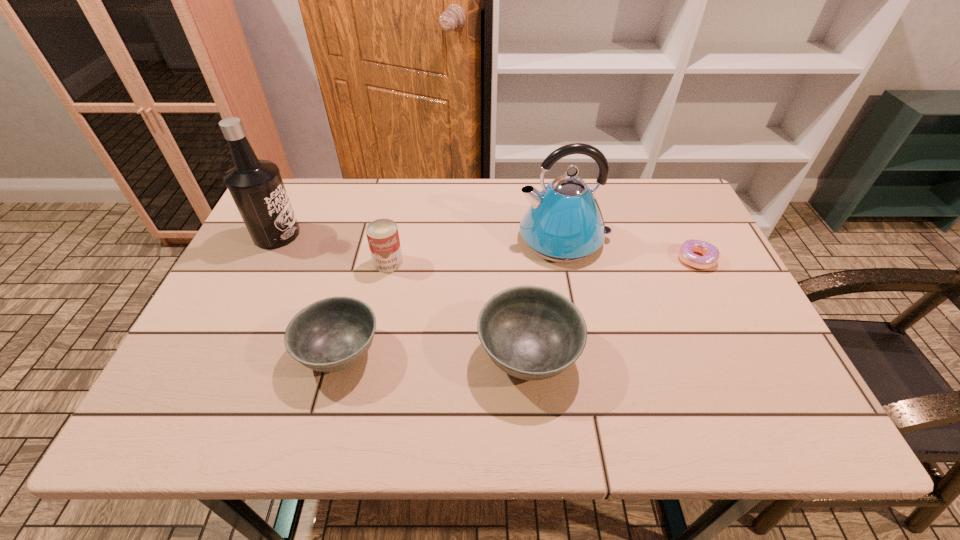
Locate an element on the screen. vacant position located at the spout of the kettle is located at coordinates (408, 239).

I want to click on vacant space located 0.240m at the spout of the kettle, so click(432, 239).

Identify the location of vacant space located at the spout of the kettle. (457, 239).

Find the location of a particular element. This screenshot has width=960, height=540. vacant space located on the front label of the liquor is located at coordinates (412, 234).

Where is `vacant space located 0.230m on the front label of the can`? Image resolution: width=960 pixels, height=540 pixels. vacant space located 0.230m on the front label of the can is located at coordinates (372, 346).

You are a GUI agent. You are given a task and a screenshot of the screen. Output one action in this format:
    pyautogui.click(x=<x>, y=<y>)
    Task: Click on the vacant space located 0.090m on the front of the doughnut
    Image resolution: width=960 pixels, height=540 pixels.
    Given the screenshot: What is the action you would take?
    pyautogui.click(x=715, y=298)

Locate an element on the screen. kettle at the far edge is located at coordinates (564, 224).

At what (x,y) coordinates should I click in order to perform the action: click on liquor positioned at the far edge. Please return your answer as a coordinate pair (x, y). Looking at the image, I should click on (256, 186).

Find the location of a particular element. This screenshot has height=540, width=960. object situated at the left edge is located at coordinates (256, 186).

What are the coordinates of `object situated at the right edge` in the screenshot? It's located at (710, 253).